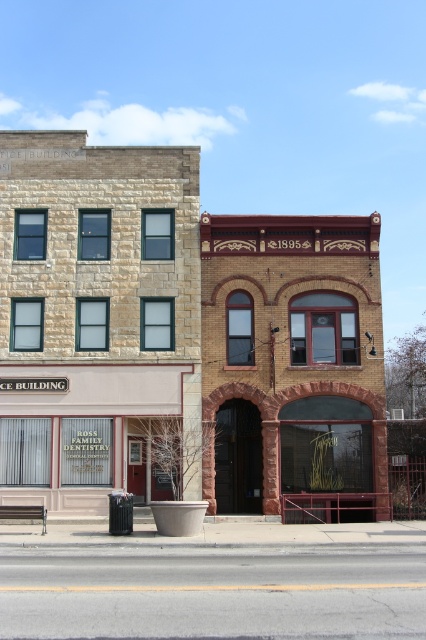
Looking at this image, is stone building at center further to the viewer compared to beige stone storefront at center?

No, it is not.

Measure the distance between stone building at center and camera.

They are 23.77 meters apart.

Identify the location of stone building at center. The height and width of the screenshot is (640, 426). pyautogui.click(x=184, y=340).

Locate an element on the screen. stone building at center is located at coordinates (184, 340).

Between brown brick building at center and beige stone storefront at center, which one appears on the left side from the viewer's perspective?

beige stone storefront at center

Between point (365, 218) and point (2, 408), which one is positioned behind?

Positioned behind is point (365, 218).

At what (x,y) coordinates should I click in order to perform the action: click on brown brick building at center. Please return your answer as a coordinate pair (x, y). The height and width of the screenshot is (640, 426). Looking at the image, I should click on (291, 358).

Can you confirm if stone building at center is shorter than brown brick building at center?

Incorrect, stone building at center's height does not fall short of brown brick building at center's.

How distant is stone building at center from brown brick building at center?

A distance of 94.62 centimeters exists between stone building at center and brown brick building at center.

Describe the element at coordinates (184, 340) in the screenshot. This screenshot has height=640, width=426. I see `stone building at center` at that location.

Find the location of `stone building at center`. stone building at center is located at coordinates (184, 340).